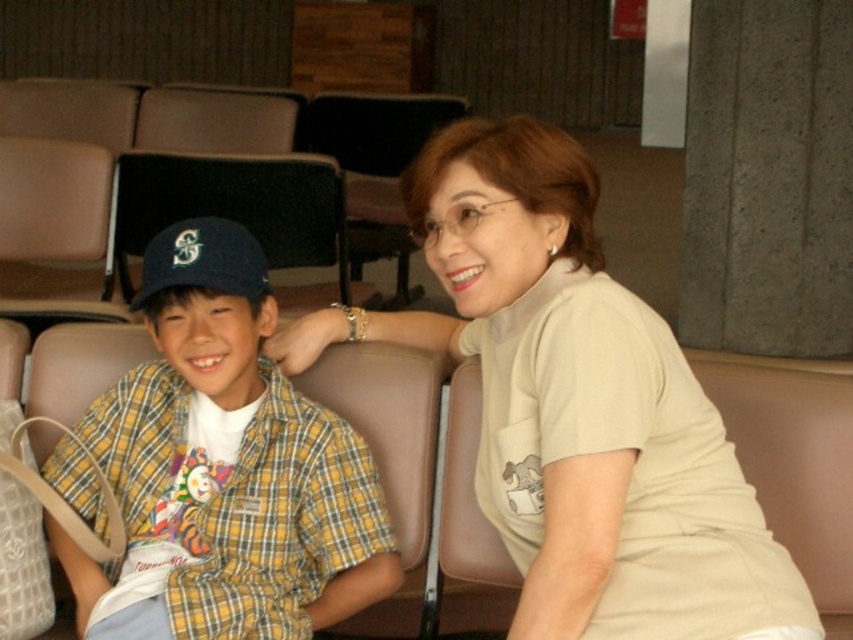
Question: Does concrete wall at upper right come in front of matte black cap at left?

Choices:
 (A) no
 (B) yes

Answer: (A)

Question: Can you confirm if concrete wall at upper right is positioned to the left of matte black cap at left?

Choices:
 (A) no
 (B) yes

Answer: (A)

Question: Can you confirm if concrete wall at upper right is smaller than brown leather chair at center?

Choices:
 (A) yes
 (B) no

Answer: (B)

Question: Estimate the real-world distances between objects in this image. Which object is farther from the beige cotton t-shirt at center?

Choices:
 (A) matte black cap at left
 (B) yellow plaid shirt at left
 (C) matte blue baseball cap at left

Answer: (A)

Question: Which point is farther to the camera?

Choices:
 (A) (323, 552)
 (B) (282, 220)
 (C) (346, 168)

Answer: (C)

Question: Among these points, which one is nearest to the camera?

Choices:
 (A) (843, 28)
 (B) (340, 144)
 (C) (695, 448)
 (D) (213, 220)

Answer: (C)